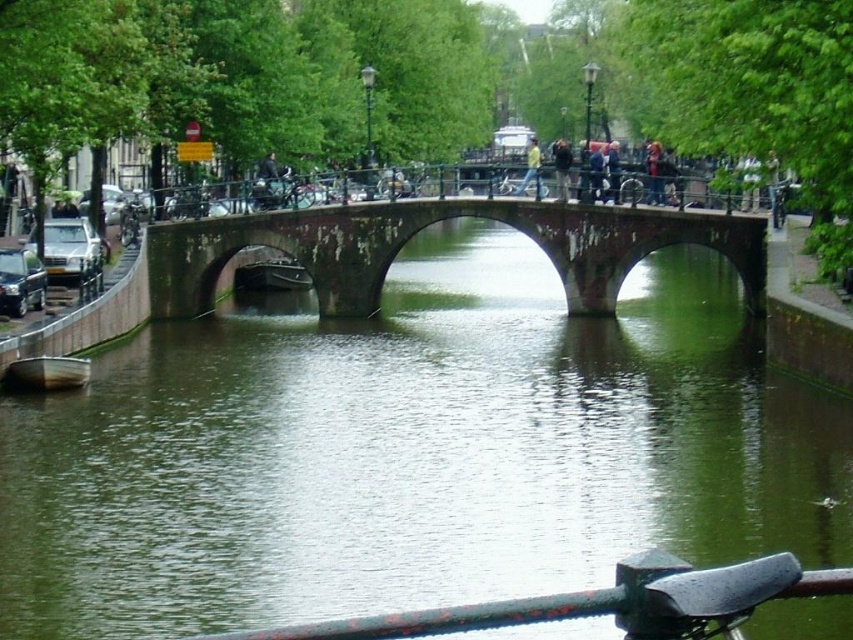
You are a tourist standing on the rusty metal rail at lower center, looking up at the rusty stone bridge at center. Which object is positioned higher relative to the other?

The rusty stone bridge at center is located above the rusty metal rail at lower center, so it is positioned higher.

You are standing on the three arches of the stone bridge and want to take a photo of the green water at center. Which direction should you face to capture it in your shot?

The green water at center is located at point coordinates, so you should face directly downward towards the water below the bridge to capture it in your photo.